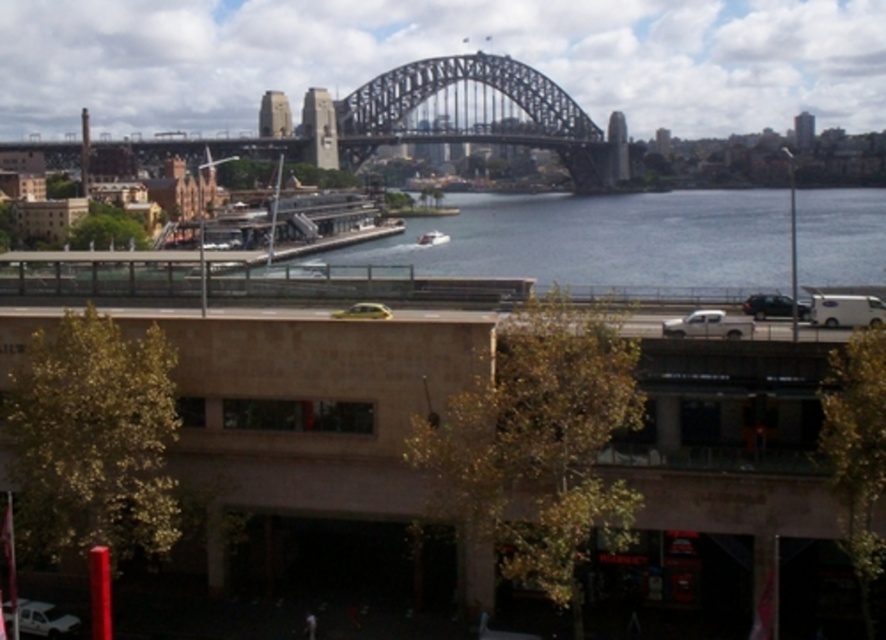
Question: Is white matte van at right smaller than shiny black sedan at center?

Choices:
 (A) no
 (B) yes

Answer: (A)

Question: Is white matte truck at right bigger than white plastic boat at center?

Choices:
 (A) yes
 (B) no

Answer: (B)

Question: Which point appears closest to the camera in this image?

Choices:
 (A) (723, 323)
 (B) (429, 243)
 (C) (822, 294)
 (D) (755, 294)

Answer: (A)

Question: Considering the real-world distances, which object is closest to the white plastic boat at center?

Choices:
 (A) shiny black sedan at center
 (B) white matte van at right

Answer: (A)

Question: Which point is farther to the camera?

Choices:
 (A) (448, 241)
 (B) (680, 328)
 (C) (354, 308)

Answer: (A)

Question: Is white matte van at right bigger than white matte truck at right?

Choices:
 (A) yes
 (B) no

Answer: (B)